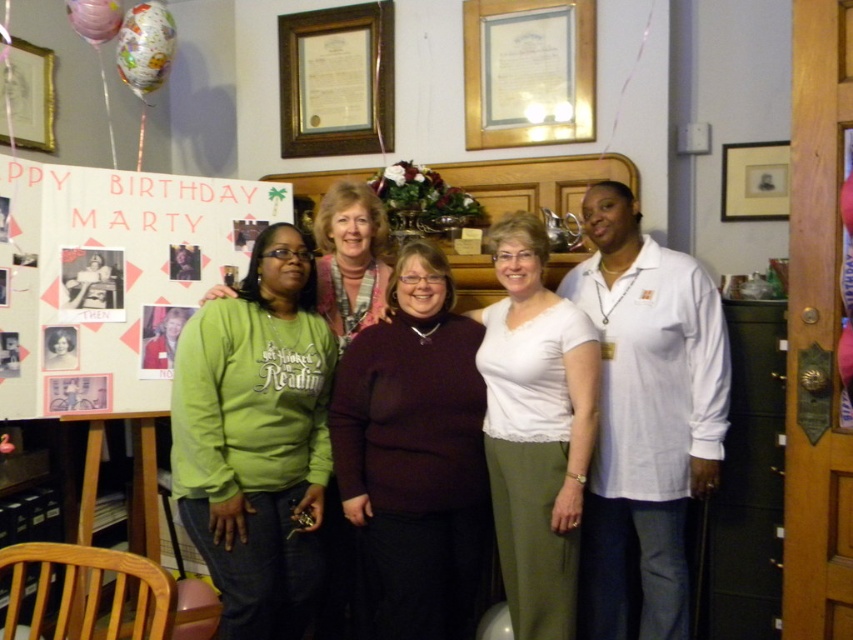
Consider the image. Does green sweatshirt at center have a greater width compared to maroon sweater at center?

Incorrect, green sweatshirt at center's width does not surpass maroon sweater at center's.

Is point (608, 419) behind point (357, 632)?

No, it is not.

Find the location of a particular element. green sweatshirt at center is located at coordinates (647, 413).

Is green sweatshirt at center bigger than white matte shirt at center?

Correct, green sweatshirt at center is larger in size than white matte shirt at center.

The height and width of the screenshot is (640, 853). What do you see at coordinates (647, 413) in the screenshot? I see `green sweatshirt at center` at bounding box center [647, 413].

Locate an element on the screen. This screenshot has height=640, width=853. green sweatshirt at center is located at coordinates (647, 413).

Is white paperboard at left below white matte shirt at center?

Incorrect, white paperboard at left is not positioned below white matte shirt at center.

In the scene shown: Is white paperboard at left to the left of white matte shirt at center from the viewer's perspective?

Yes, white paperboard at left is to the left of white matte shirt at center.

Is point (4, 180) positioned behind point (537, 355)?

Yes, it is behind point (537, 355).

Identify the location of white paperboard at left. (109, 276).